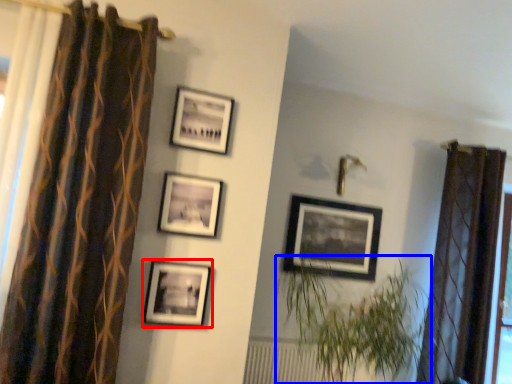
Question: Which object appears closest to the camera in this image, picture frame (highlighted by a red box) or houseplant (highlighted by a blue box)?

Choices:
 (A) picture frame
 (B) houseplant

Answer: (B)